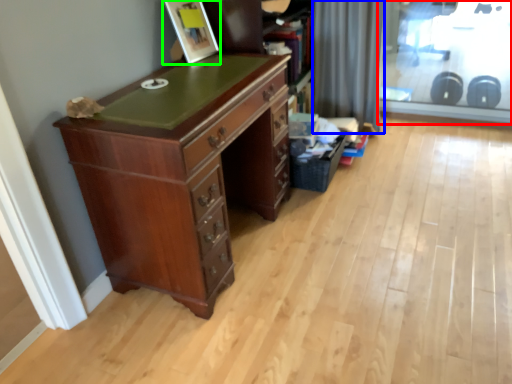
Question: Based on their relative distances, which object is nearer to screen door (highlighted by a red box)? Choose from curtain (highlighted by a blue box) and picture frame (highlighted by a green box).

Choices:
 (A) curtain
 (B) picture frame

Answer: (A)